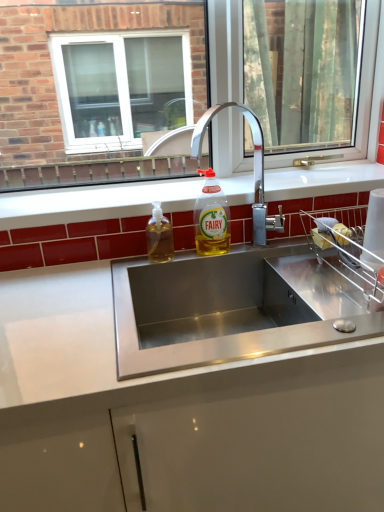
Where is `blank space to the left of yellow translucent liquid at sink center, which ranks as the 2th bottle in left-to-right order`? blank space to the left of yellow translucent liquid at sink center, which ranks as the 2th bottle in left-to-right order is located at coordinates (166, 261).